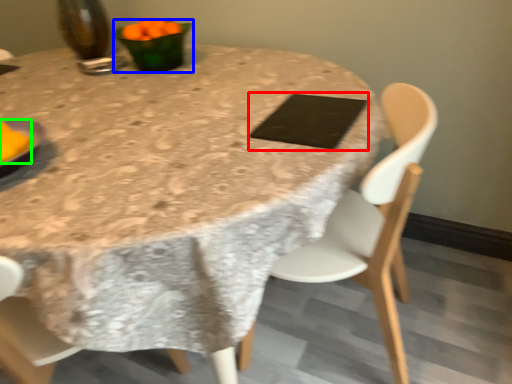
Question: Estimate the real-world distances between objects in this image. Which object is closer to pad (highlighted by a red box), tableware (highlighted by a blue box) or food (highlighted by a green box)?

Choices:
 (A) tableware
 (B) food

Answer: (A)